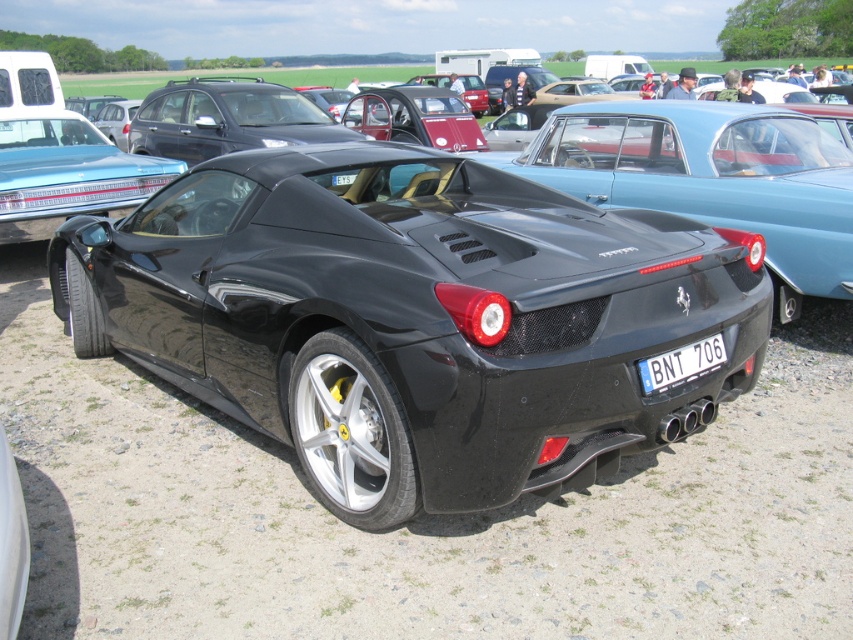
You are a photographer at a car show and want to take a picture of the white plastic license plate at center and the shiny black sports car at center. From the photographer perspective, which object is positioned to the left?

The shiny black sports car at center is to the left of the white plastic license plate at center.

You are a photographer trying to capture the entire shiny black sports car at center and the white plastic license plate at center in one frame. Given that the license plate is smaller, will you need to adjust your camera to focus on both objects simultaneously?

The shiny black sports car at center is larger than the white plastic license plate at center, so you can capture both in one frame without needing to adjust the focus since the license plate is smaller and part of the car.